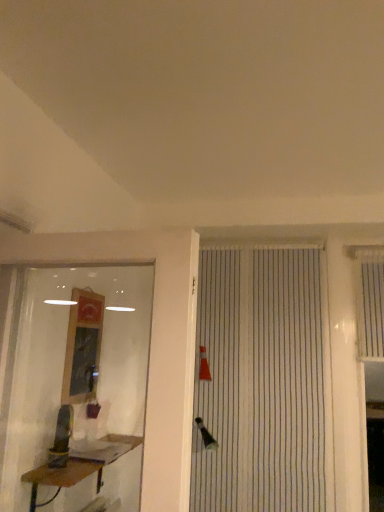
Question: Does white striped shutter at right have a smaller size compared to brown wooden table at lower left?

Choices:
 (A) no
 (B) yes

Answer: (B)

Question: From a real-world perspective, is white striped shutter at right on brown wooden table at lower left?

Choices:
 (A) yes
 (B) no

Answer: (A)

Question: From the image's perspective, is white striped shutter at right beneath brown wooden table at lower left?

Choices:
 (A) no
 (B) yes

Answer: (A)

Question: Would you consider white striped shutter at right to be distant from brown wooden table at lower left?

Choices:
 (A) no
 (B) yes

Answer: (B)

Question: Does white striped shutter at right come in front of brown wooden table at lower left?

Choices:
 (A) yes
 (B) no

Answer: (B)

Question: Is white striped shutter at right touching brown wooden table at lower left?

Choices:
 (A) no
 (B) yes

Answer: (A)

Question: Considering the relative positions of brown wooden table at lower left and white striped shutter at right in the image provided, is brown wooden table at lower left to the right of white striped shutter at right from the viewer's perspective?

Choices:
 (A) yes
 (B) no

Answer: (B)

Question: Does brown wooden table at lower left touch white striped shutter at right?

Choices:
 (A) no
 (B) yes

Answer: (A)

Question: Is brown wooden table at lower left far away from white striped shutter at right?

Choices:
 (A) no
 (B) yes

Answer: (B)

Question: Is brown wooden table at lower left taller than white striped shutter at right?

Choices:
 (A) no
 (B) yes

Answer: (A)

Question: Could white striped shutter at right be considered to be inside brown wooden table at lower left?

Choices:
 (A) yes
 (B) no

Answer: (B)

Question: Is brown wooden table at lower left positioned with its back to white striped shutter at right?

Choices:
 (A) no
 (B) yes

Answer: (A)

Question: Is the depth of wooden framed mirror at left less than that of brown wooden table at lower left?

Choices:
 (A) yes
 (B) no

Answer: (B)